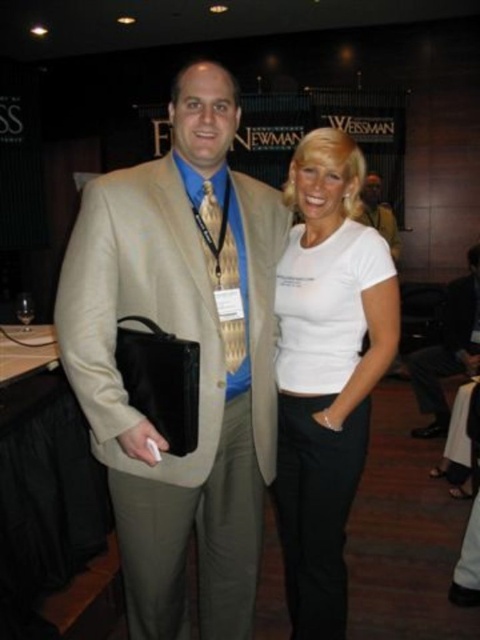
Which is in front, point (135, 456) or point (392, 232)?

Positioned in front is point (135, 456).

Does tan fabric suit at center have a greater width compared to matte beige suit at center?

Incorrect, tan fabric suit at center's width does not surpass matte beige suit at center's.

Is point (79, 280) positioned in front of point (395, 260)?

Yes, it is in front of point (395, 260).

Where is `tan fabric suit at center`? The image size is (480, 640). tan fabric suit at center is located at coordinates (200, 358).

Which is more to the right, tan fabric suit at center or light beige suit at center?

Positioned to the right is light beige suit at center.

Is point (88, 230) in front of point (441, 387)?

Yes.

This screenshot has width=480, height=640. Find the location of `tan fabric suit at center`. tan fabric suit at center is located at coordinates (200, 358).

Between light beige suit at center and matte beige suit at center, which one is positioned higher?

matte beige suit at center

Is light beige suit at center behind matte beige suit at center?

No, it is in front of matte beige suit at center.

At what (x,y) coordinates should I click in order to perform the action: click on light beige suit at center. Please return your answer as a coordinate pair (x, y). This screenshot has height=640, width=480. Looking at the image, I should click on (448, 349).

Find the location of `light beige suit at center`. light beige suit at center is located at coordinates (448, 349).